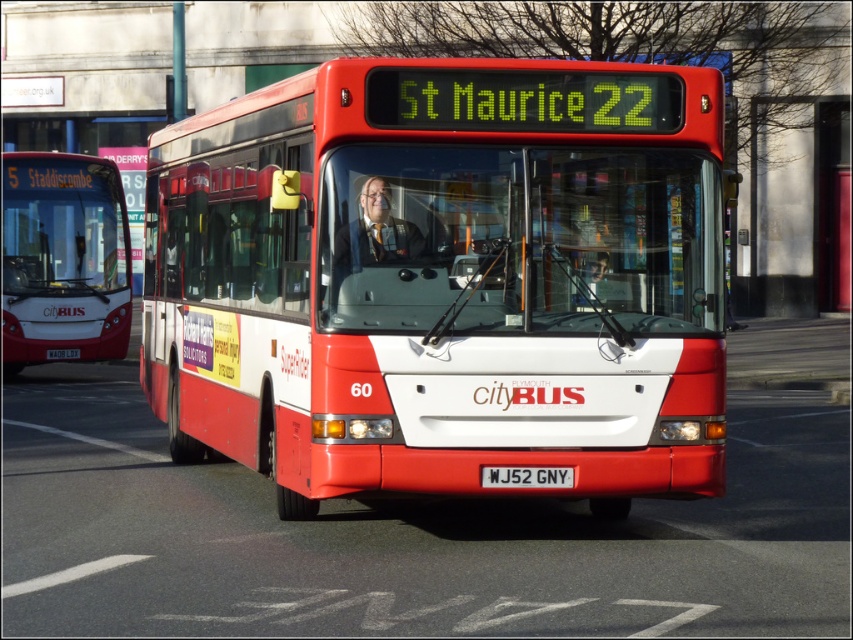
Question: Can you confirm if matte red bus at center is positioned below matte black bus at left?

Choices:
 (A) yes
 (B) no

Answer: (A)

Question: Which of these objects is positioned closest to the white plastic license plate at center?

Choices:
 (A) matte black bus at left
 (B) matte red bus at center

Answer: (B)

Question: Which of the following is the closest to the observer?

Choices:
 (A) click(x=338, y=104)
 (B) click(x=514, y=472)
 (C) click(x=10, y=365)

Answer: (A)

Question: Can you confirm if matte black bus at left is wider than white plastic license plate at center?

Choices:
 (A) yes
 (B) no

Answer: (A)

Question: Which of the following is the farthest from the observer?

Choices:
 (A) matte black bus at left
 (B) white plastic license plate at center
 (C) matte red bus at center

Answer: (A)

Question: Does matte red bus at center come behind white plastic license plate at center?

Choices:
 (A) no
 (B) yes

Answer: (A)